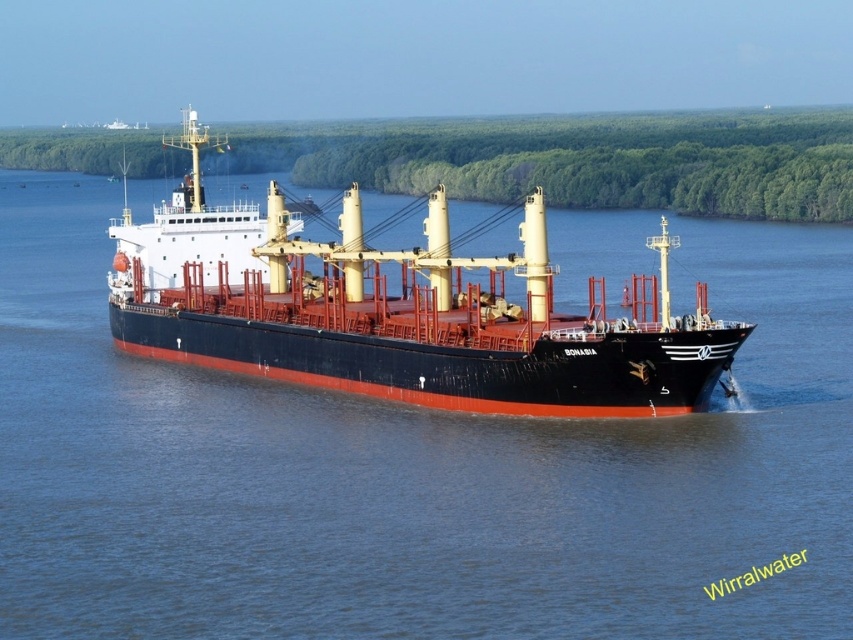
Is point (689, 228) positioned before point (294, 273)?

That is False.

Does blue water at center have a larger size compared to black matte cargo ship at center?

No.

Does point (109, 580) come behind point (689, 410)?

No, it is in front of (689, 410).

The width and height of the screenshot is (853, 640). What are the coordinates of `blue water at center` in the screenshot? It's located at (413, 472).